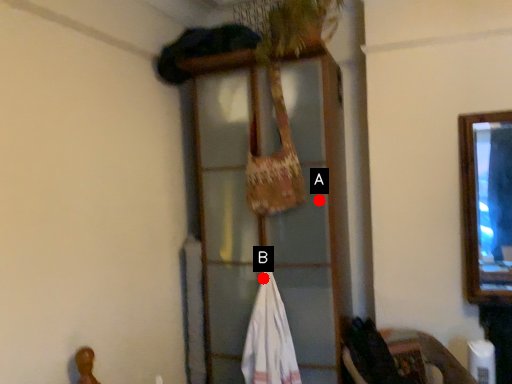
Question: Two points are circled on the image, labeled by A and B beside each circle. Which point appears farthest from the camera in this image?

Choices:
 (A) A is further
 (B) B is further

Answer: (B)